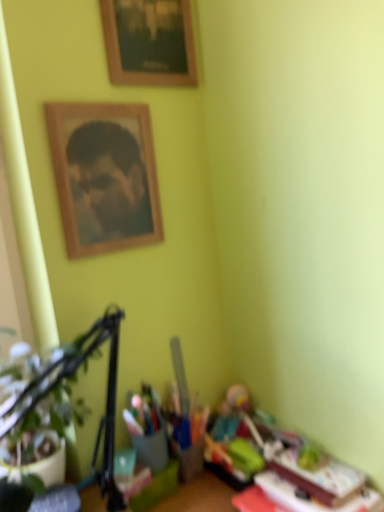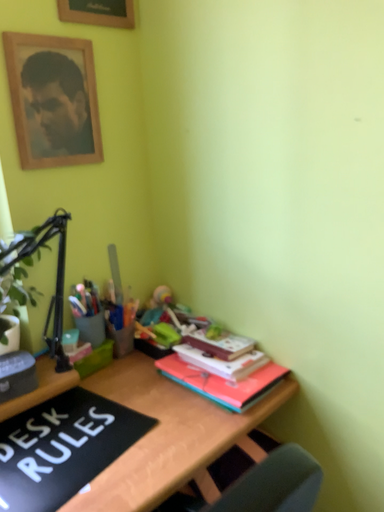
Question: How did the camera likely rotate when shooting the video?

Choices:
 (A) rotated upward
 (B) rotated downward

Answer: (B)